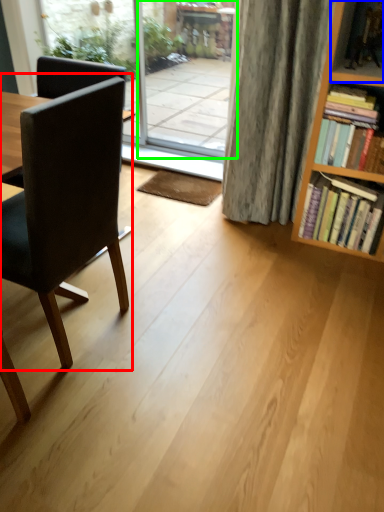
Question: Which is nearer to the chair (highlighted by a red box)? shelf (highlighted by a blue box) or screen door (highlighted by a green box).

Choices:
 (A) shelf
 (B) screen door

Answer: (A)